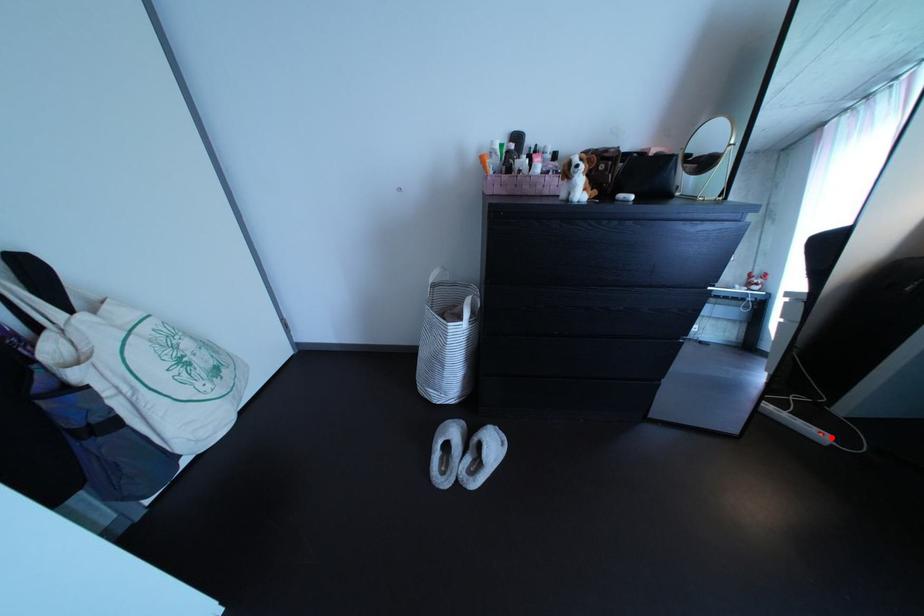
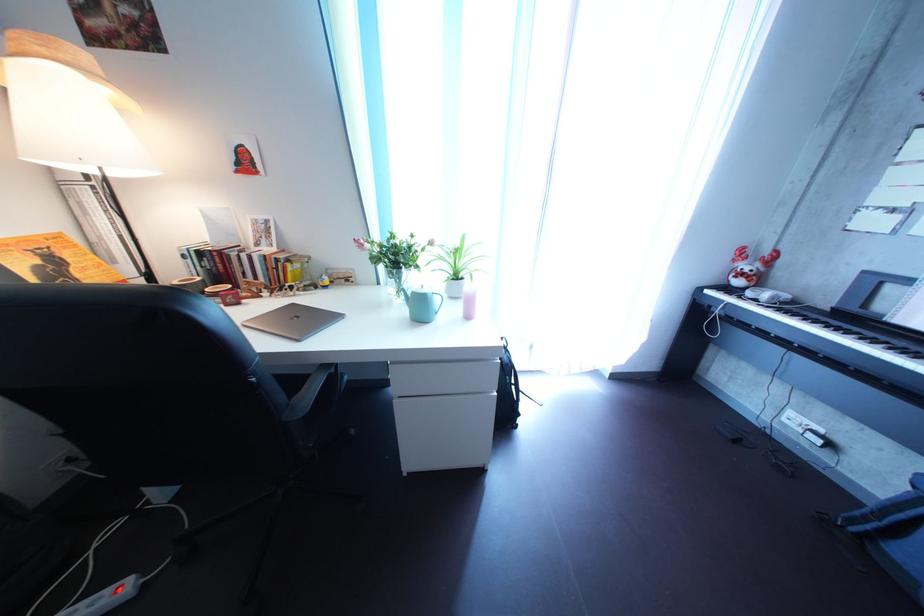
Locate, in the second image, the point that corresponds to the highlighted location in the first image.

(122, 601)